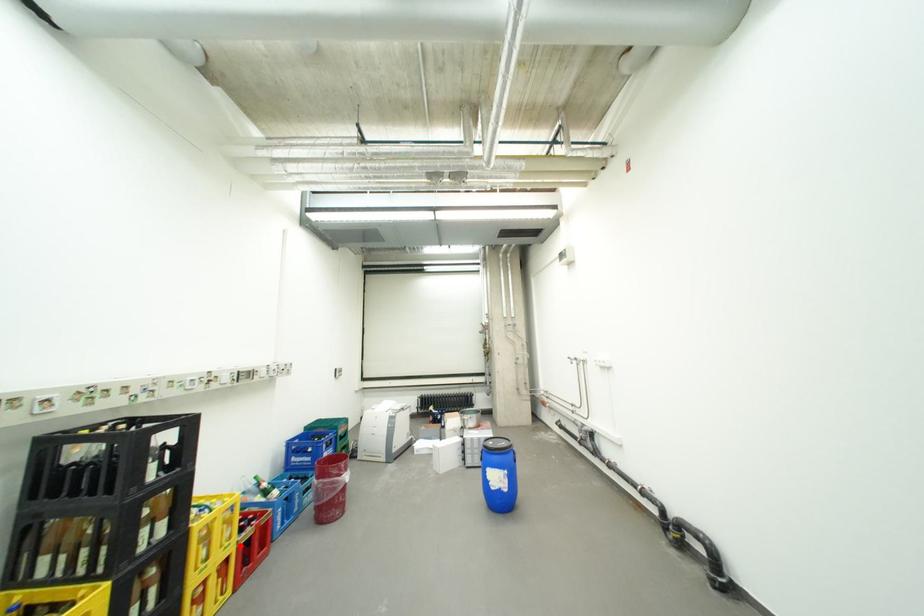
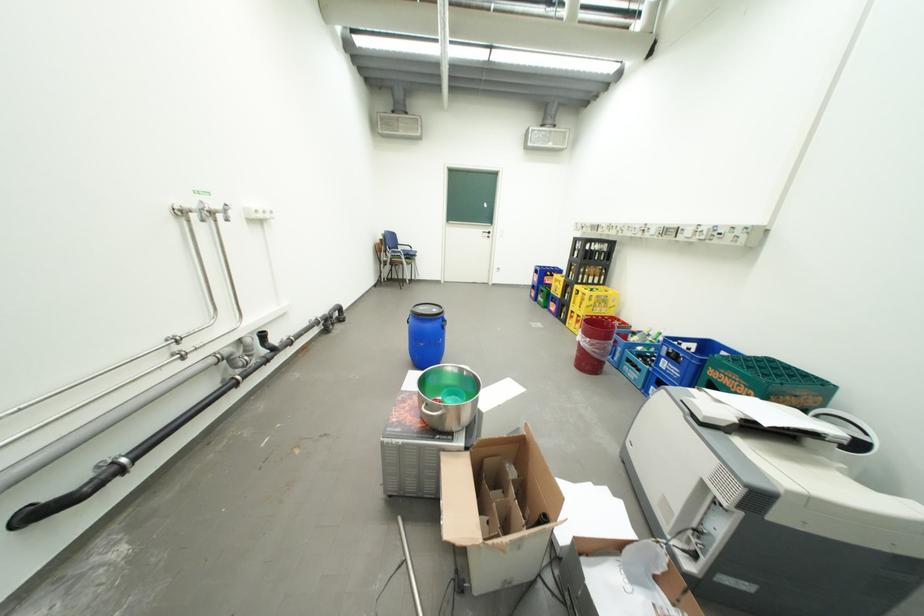
Question: A red point is marked in image1. In image2, is the corresponding 3D point closer to the camera or farther? Reply with the corresponding letter.

Choices:
 (A) The corresponding 3D point is closer.
 (B) The corresponding 3D point is farther.

Answer: (A)